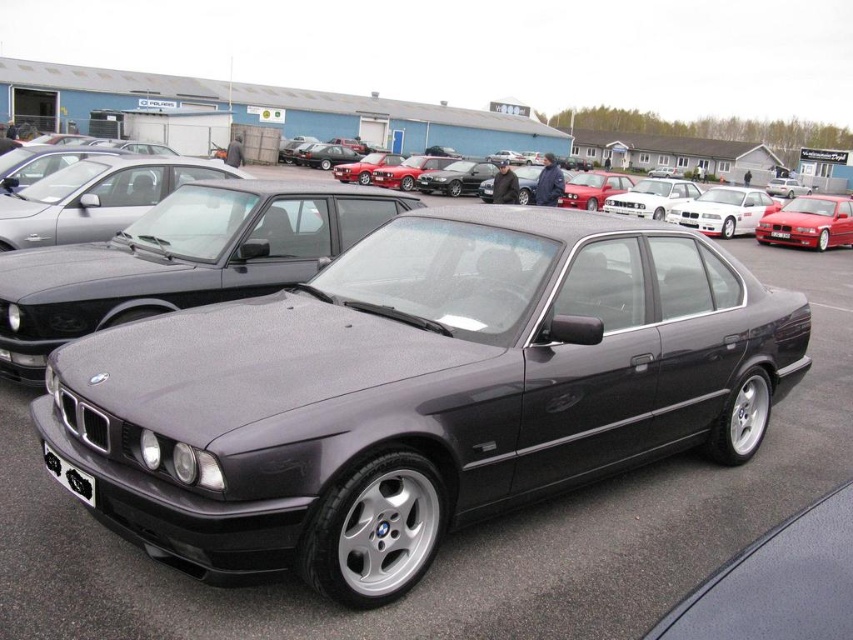
Question: Which of the following is the closest to the observer?

Choices:
 (A) metallic red sedan at right
 (B) black plastic license plate at center
 (C) satin black car at center

Answer: (C)

Question: Based on their relative distances, which object is nearer to the black plastic license plate at center?

Choices:
 (A) satin black car at center
 (B) metallic red sedan at right

Answer: (B)

Question: Can you confirm if metallic red sedan at right is positioned above black plastic license plate at center?

Choices:
 (A) no
 (B) yes

Answer: (B)

Question: Is metallic red sedan at right smaller than black plastic license plate at center?

Choices:
 (A) no
 (B) yes

Answer: (A)

Question: Which of the following is the farthest from the observer?

Choices:
 (A) (334, 230)
 (B) (775, 234)
 (C) (840, 228)

Answer: (C)

Question: Is satin black car at center to the left of metallic red sedan at right from the viewer's perspective?

Choices:
 (A) yes
 (B) no

Answer: (A)